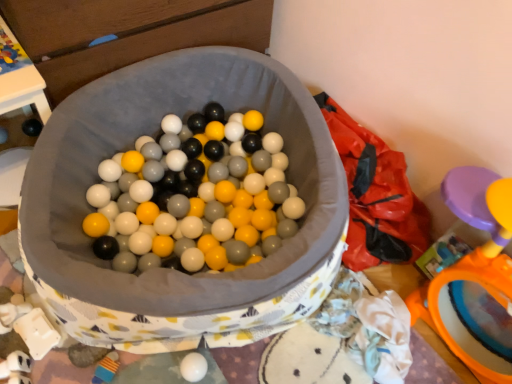
Where is `vacant area that lies to the right of white matte egg at center`? This screenshot has height=384, width=512. vacant area that lies to the right of white matte egg at center is located at coordinates (247, 360).